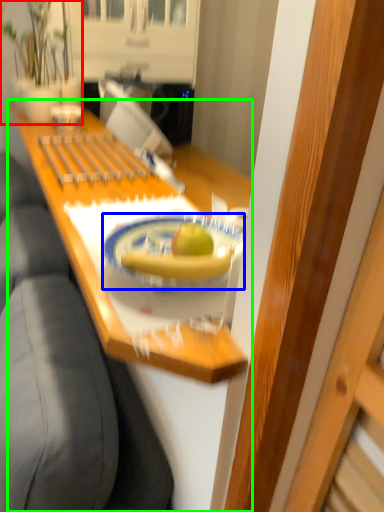
Question: Considering the real-world distances, which object is closest to houseplant (highlighted by a red box)? plate (highlighted by a blue box) or desk (highlighted by a green box).

Choices:
 (A) plate
 (B) desk

Answer: (B)